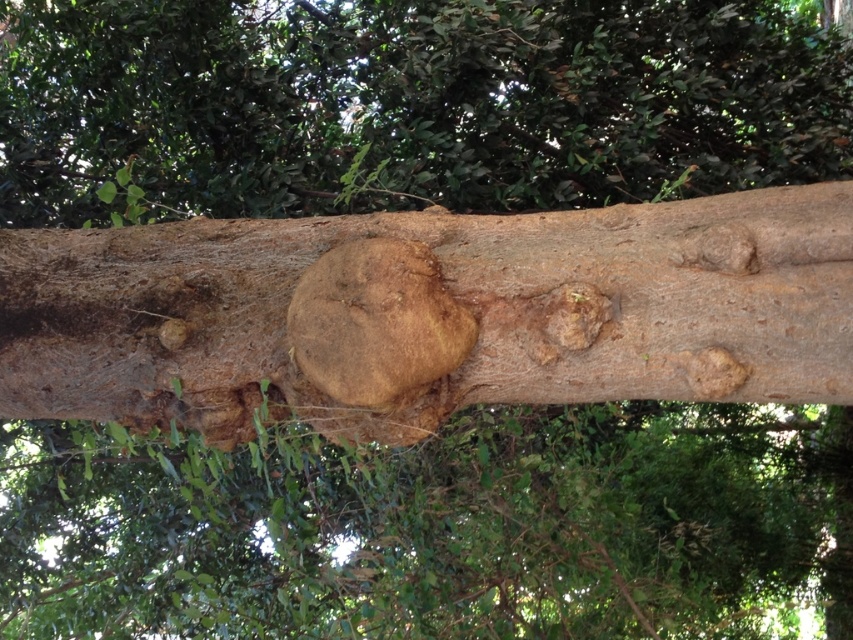
Question: Is the position of smooth brown bark at center less distant than that of brown rough tree knot at center?

Choices:
 (A) yes
 (B) no

Answer: (A)

Question: Which object appears farthest from the camera in this image?

Choices:
 (A) brown rough tree knot at center
 (B) smooth brown bark at center

Answer: (A)

Question: Which point is farther from the camera taking this photo?

Choices:
 (A) (299, 340)
 (B) (361, 314)

Answer: (A)

Question: Is smooth brown bark at center positioned at the back of brown rough tree knot at center?

Choices:
 (A) yes
 (B) no

Answer: (B)

Question: Does smooth brown bark at center appear over brown rough tree knot at center?

Choices:
 (A) no
 (B) yes

Answer: (B)